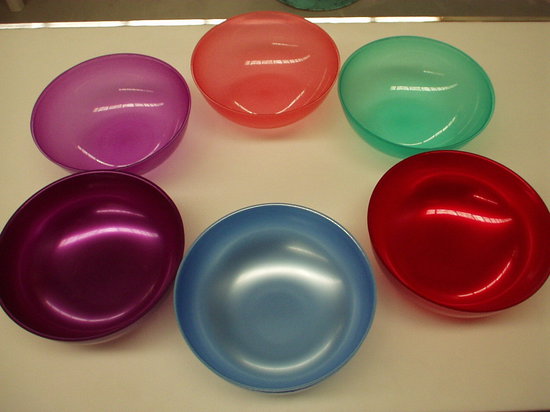
Where is `light purple bowl`? The image size is (550, 412). light purple bowl is located at coordinates (99, 91).